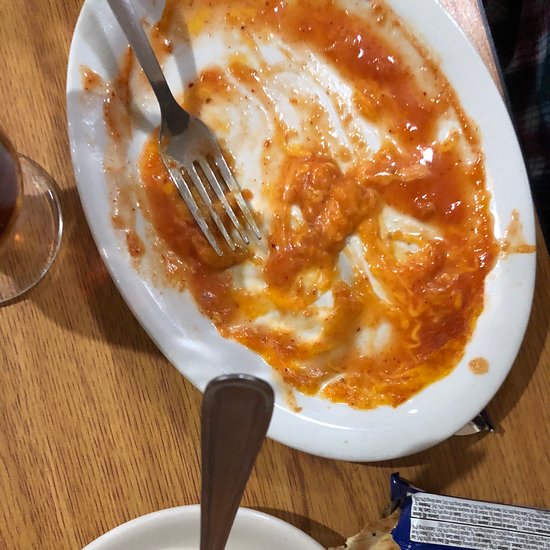
This screenshot has height=550, width=550. I want to click on drinking glass, so click(34, 214).